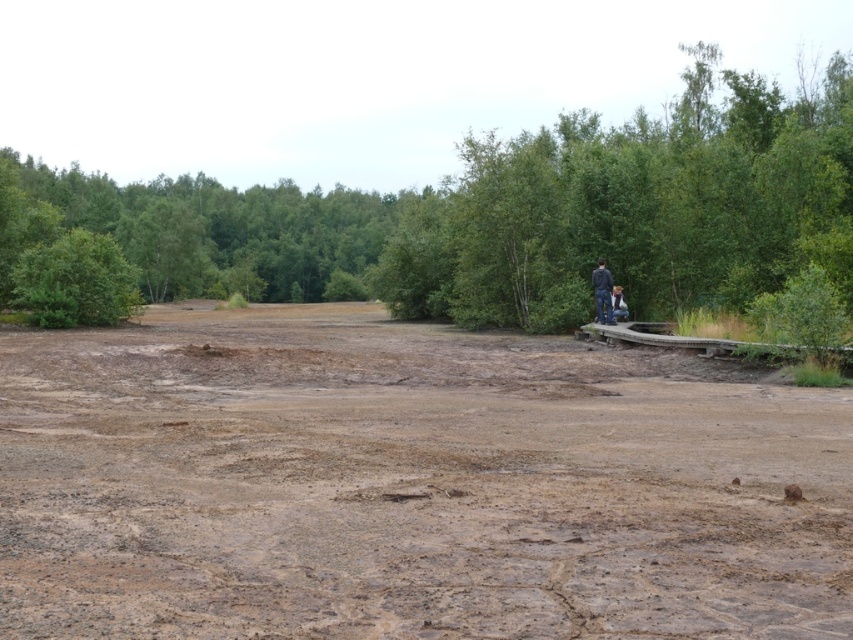
Question: Is brown textured dirt field at center above dark blue jeans at center?

Choices:
 (A) yes
 (B) no

Answer: (B)

Question: Among these points, which one is nearest to the camera?

Choices:
 (A) (601, 317)
 (B) (619, 316)
 (C) (178, 545)
 (D) (740, 248)

Answer: (C)

Question: Does green leafy forest at center lie in front of dark blue jeans at center-right?

Choices:
 (A) no
 (B) yes

Answer: (B)

Question: Is brown textured dirt field at center smaller than green leafy forest at center?

Choices:
 (A) yes
 (B) no

Answer: (A)

Question: Which point is farther from the camera taking this photo?

Choices:
 (A) (598, 300)
 (B) (268, 262)
 (C) (625, 307)
 (D) (35, 497)

Answer: (B)

Question: Based on their relative distances, which object is nearer to the dark blue jeans at center-right?

Choices:
 (A) dark blue jeans at center
 (B) brown textured dirt field at center
 (C) green leafy forest at center

Answer: (A)